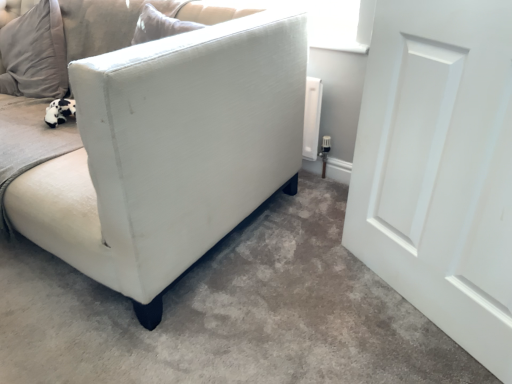
Question: Considering the relative sizes of white fabric couch at left and white fabric sofa at lower left in the image provided, is white fabric couch at left bigger than white fabric sofa at lower left?

Choices:
 (A) no
 (B) yes

Answer: (B)

Question: Considering the relative sizes of white fabric couch at left and white fabric sofa at lower left in the image provided, is white fabric couch at left wider than white fabric sofa at lower left?

Choices:
 (A) yes
 (B) no

Answer: (B)

Question: From a real-world perspective, is white fabric couch at left under white fabric sofa at lower left?

Choices:
 (A) yes
 (B) no

Answer: (B)

Question: Considering the relative sizes of white fabric couch at left and white fabric sofa at lower left in the image provided, is white fabric couch at left taller than white fabric sofa at lower left?

Choices:
 (A) no
 (B) yes

Answer: (B)

Question: Does white fabric couch at left appear on the right side of white fabric sofa at lower left?

Choices:
 (A) yes
 (B) no

Answer: (B)

Question: Which is correct: white matte door at right is inside white fabric couch at left, or outside of it?

Choices:
 (A) outside
 (B) inside

Answer: (A)

Question: Is white matte door at right to the left or to the right of white fabric couch at left in the image?

Choices:
 (A) right
 (B) left

Answer: (A)

Question: Is point (370, 170) positioned closer to the camera than point (168, 253)?

Choices:
 (A) farther
 (B) closer

Answer: (A)

Question: Is white matte door at right in front of or behind white fabric couch at left in the image?

Choices:
 (A) behind
 (B) front

Answer: (B)

Question: From the image's perspective, is white matte door at right located above or below white fabric sofa at lower left?

Choices:
 (A) above
 (B) below

Answer: (A)

Question: Considering the positions of point (381, 102) and point (26, 364), is point (381, 102) closer or farther from the camera than point (26, 364)?

Choices:
 (A) closer
 (B) farther

Answer: (B)

Question: Is white matte door at right wider or thinner than white fabric sofa at lower left?

Choices:
 (A) wide
 (B) thin

Answer: (B)

Question: Relative to white fabric sofa at lower left, is white matte door at right in front or behind?

Choices:
 (A) front
 (B) behind

Answer: (B)

Question: From the image's perspective, relative to white fabric couch at left, is white fabric sofa at lower left above or below?

Choices:
 (A) above
 (B) below

Answer: (B)

Question: Looking at their shapes, would you say white fabric sofa at lower left is wider or thinner than white fabric couch at left?

Choices:
 (A) wide
 (B) thin

Answer: (A)